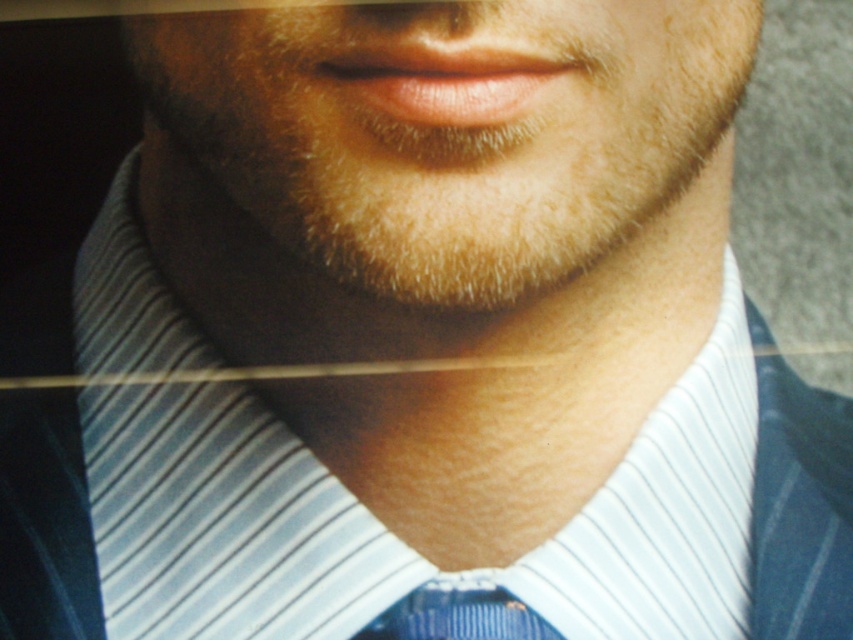
Question: Which is nearer to the blue striped tie at center?

Choices:
 (A) white striped fabric at center
 (B) smooth skin at center

Answer: (A)

Question: Among these objects, which one is nearest to the camera?

Choices:
 (A) blue striped tie at center
 (B) smooth skin at center
 (C) white striped fabric at center

Answer: (B)

Question: Can you confirm if smooth skin at center is positioned below blue striped tie at center?

Choices:
 (A) yes
 (B) no

Answer: (B)

Question: Among these points, which one is nearest to the camera?

Choices:
 (A) (647, 525)
 (B) (236, 211)
 (C) (363, 632)

Answer: (B)

Question: Is white striped fabric at center positioned before blue striped tie at center?

Choices:
 (A) yes
 (B) no

Answer: (B)

Question: Does white striped fabric at center come in front of blue striped tie at center?

Choices:
 (A) no
 (B) yes

Answer: (A)